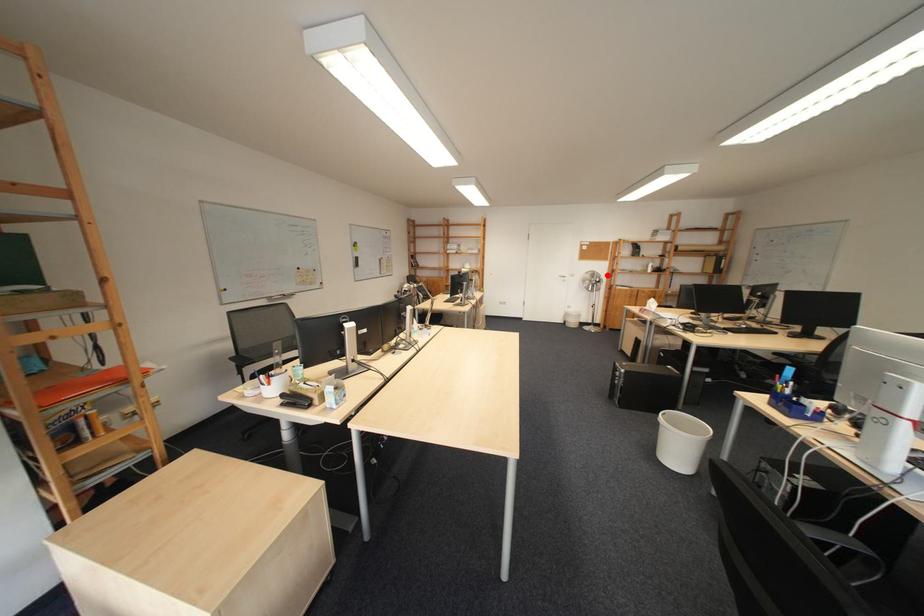
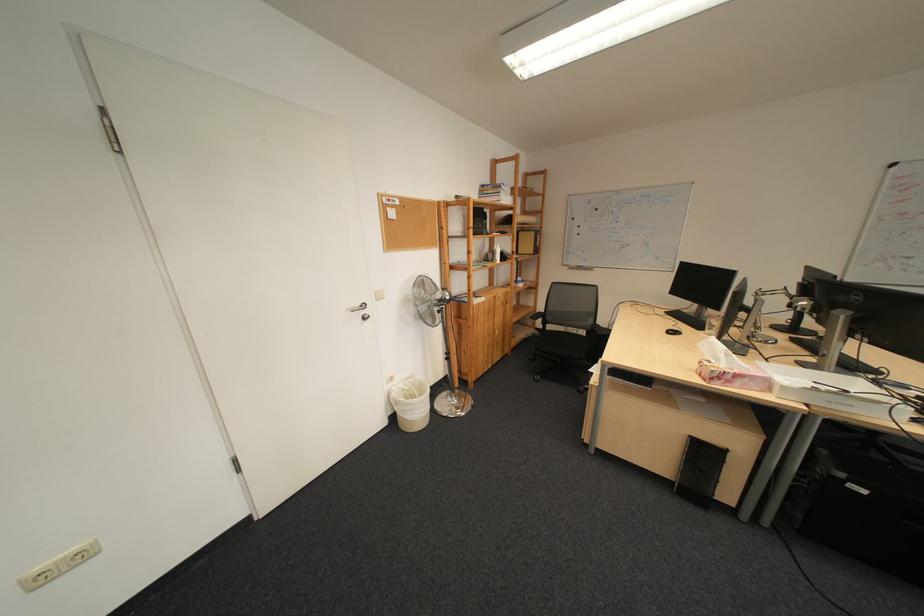
Where in the second image is the point corresponding to the highlighted location from the first image?

(435, 284)